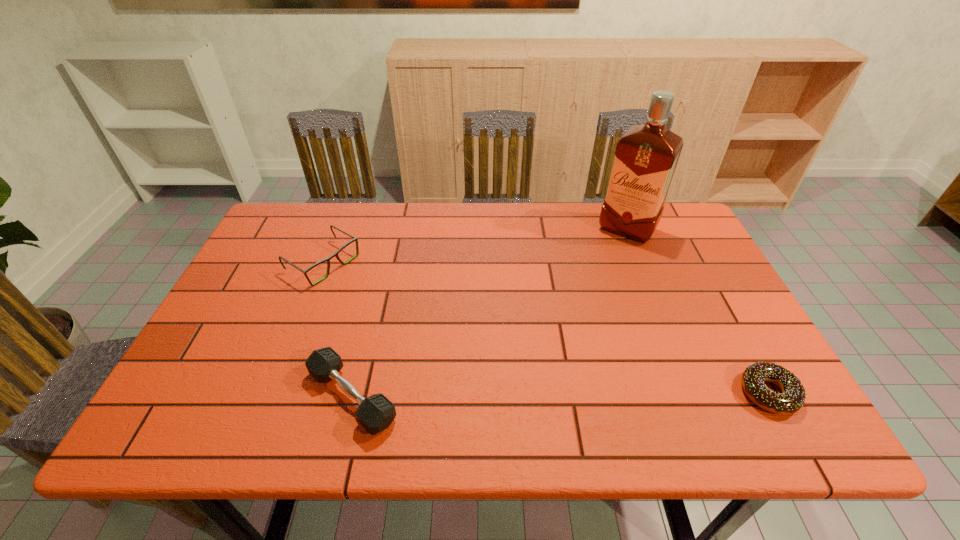
The image size is (960, 540). Identify the location of free point located on the front label of the tallest object. (588, 287).

You are a GUI agent. You are given a task and a screenshot of the screen. Output one action in this format:
    pyautogui.click(x=<x>, y=<y>)
    Task: Click on the free spot located on the lens of the spectacles
    The width and height of the screenshot is (960, 540).
    Given the screenshot: What is the action you would take?
    pyautogui.click(x=394, y=307)

I want to click on vacant space located on the lens of the spectacles, so click(394, 307).

Locate an element on the screen. This screenshot has height=540, width=960. free space located on the lens of the spectacles is located at coordinates (385, 302).

I want to click on liquor located in the far edge section of the desktop, so click(646, 156).

You are a GUI agent. You are given a task and a screenshot of the screen. Output one action in this format:
    pyautogui.click(x=<x>, y=<y>)
    Task: Click on the spectacles present at the far edge
    The height and width of the screenshot is (540, 960).
    Given the screenshot: What is the action you would take?
    pyautogui.click(x=355, y=239)

Locate an element on the screen. This screenshot has height=540, width=960. dumbbell that is positioned at the near edge is located at coordinates (375, 413).

I want to click on doughnut at the near edge, so click(793, 396).

Where is `object that is at the left edge`? This screenshot has height=540, width=960. object that is at the left edge is located at coordinates (355, 239).

Locate an element on the screen. The width and height of the screenshot is (960, 540). doughnut located in the right edge section of the desktop is located at coordinates pos(793,396).